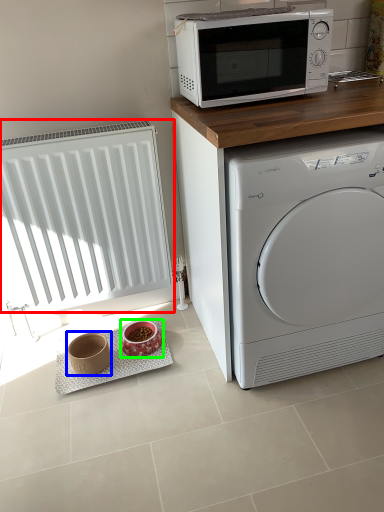
Question: Which is nearer to the radiator (highlighted by a red box)? appliance (highlighted by a blue box) or appliance (highlighted by a green box).

Choices:
 (A) appliance
 (B) appliance

Answer: (A)